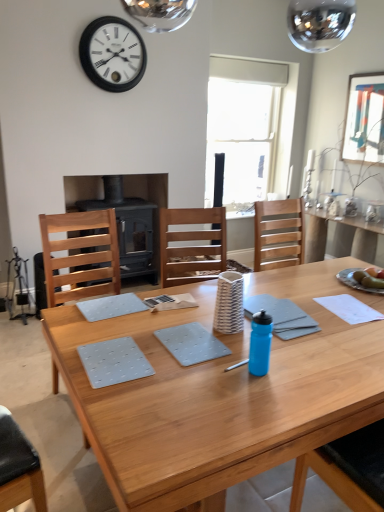
The image size is (384, 512). Identify the location of vacant space in front of blue plastic water bottle at center. (261, 397).